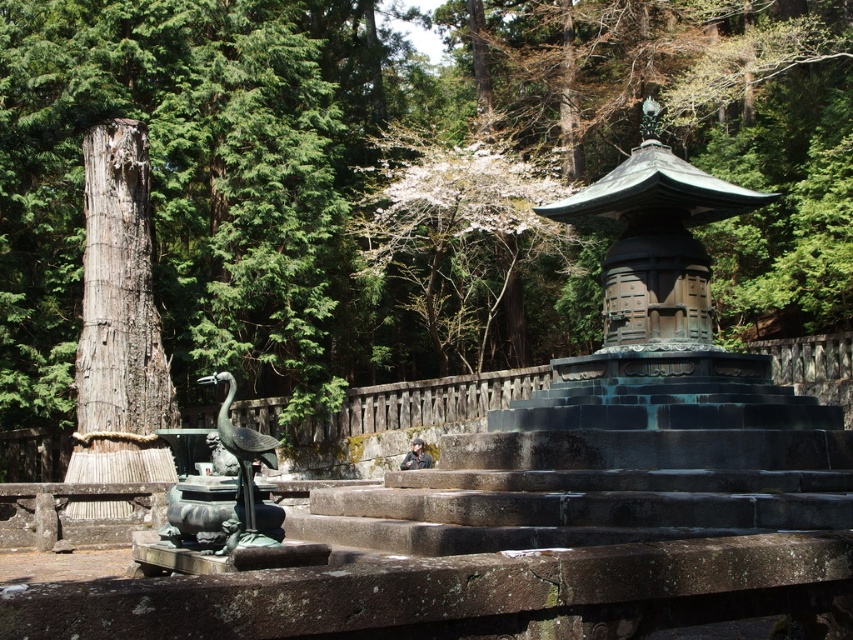
Does smooth bark tree at left have a lesser width compared to bronze statue at center?

No.

The image size is (853, 640). What do you see at coordinates (402, 177) in the screenshot? I see `smooth bark tree at left` at bounding box center [402, 177].

You are a GUI agent. You are given a task and a screenshot of the screen. Output one action in this format:
    pyautogui.click(x=<x>, y=<y>)
    Task: Click on the smooth bark tree at left
    
    Given the screenshot: What is the action you would take?
    pyautogui.click(x=402, y=177)

Locate an element on the screen. This screenshot has height=640, width=853. white blossoms at upper center is located at coordinates (456, 228).

Can you confirm if white blossoms at upper center is shorter than weathered wood pillar at left?

No.

Between point (473, 211) and point (167, 403), which one is positioned behind?

The point (473, 211) is behind.

The height and width of the screenshot is (640, 853). I want to click on white blossoms at upper center, so click(456, 228).

Does smooth bark tree at left appear on the right side of weathered wood pillar at left?

Correct, you'll find smooth bark tree at left to the right of weathered wood pillar at left.

Is smooth bark tree at left closer to the viewer compared to weathered wood pillar at left?

No, it is not.

Between point (552, 116) and point (96, 244), which one is positioned behind?

Point (552, 116)

Identify the location of smooth bark tree at left. (402, 177).